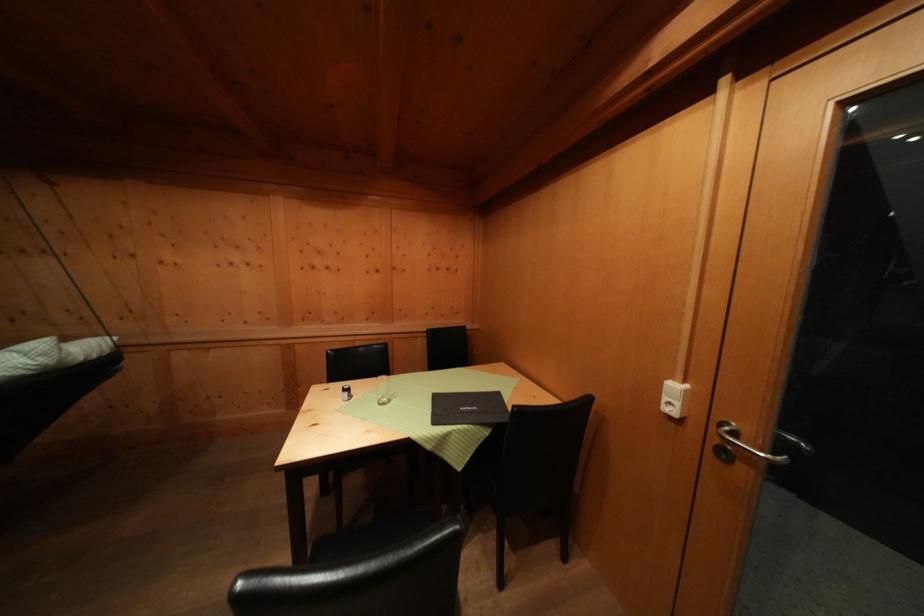
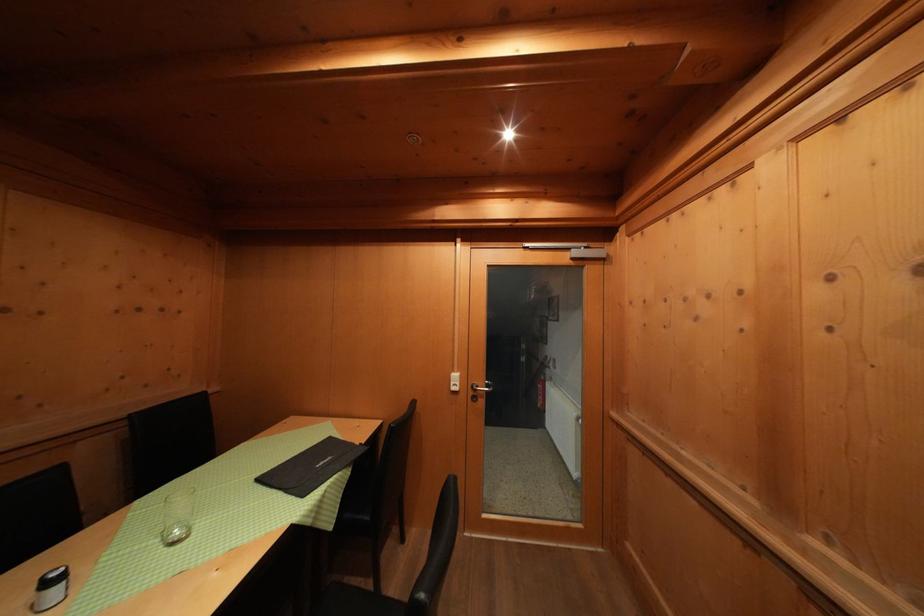
Question: The camera is either moving clockwise (left) or counter-clockwise (right) around the object. The first image is from the beginning of the video and the second image is from the end. Is the camera moving left or right when shooting the video?

Choices:
 (A) Left
 (B) Right

Answer: (A)